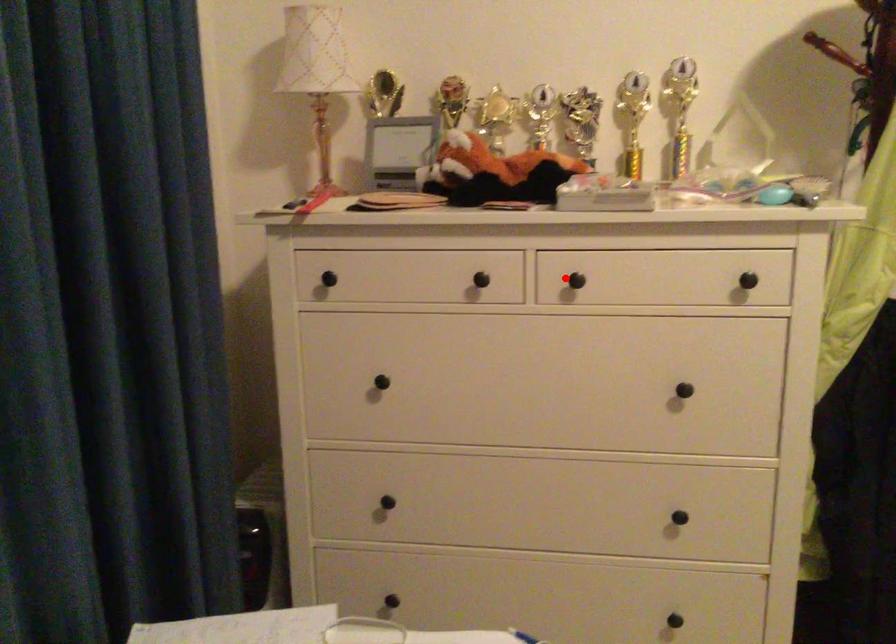
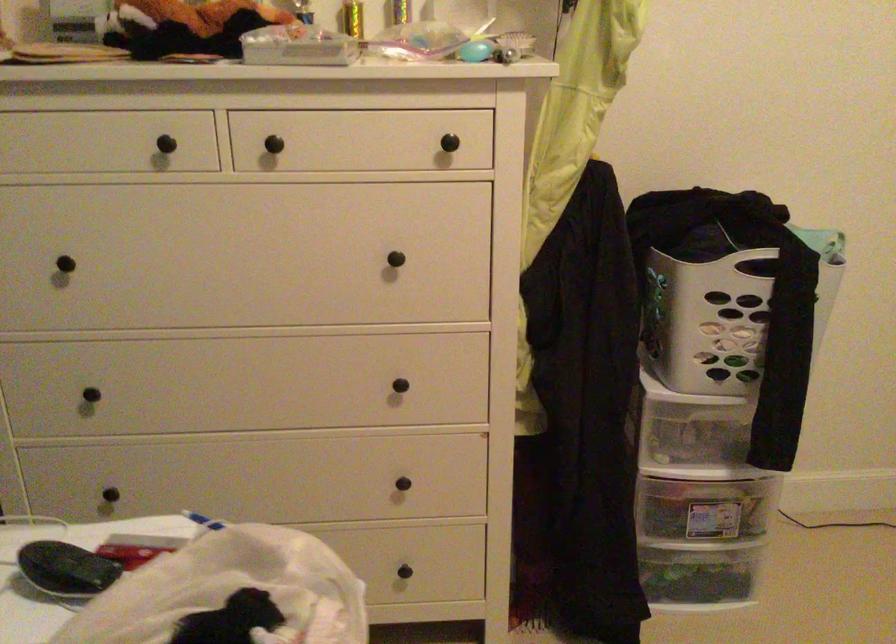
The point at the highlighted location is marked in the first image. Where is the corresponding point in the second image?

(261, 140)